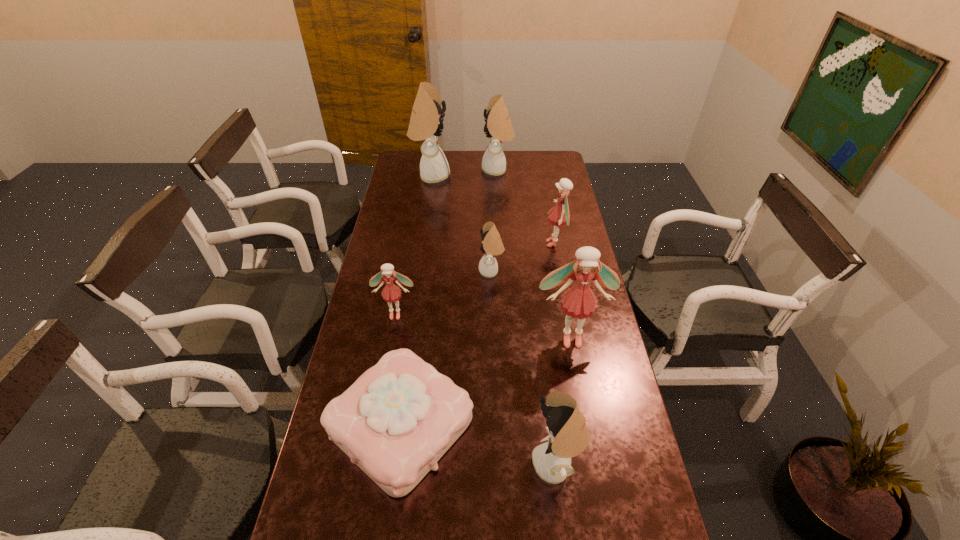
The image size is (960, 540). What are the coordinates of `the leftmost black doll` in the screenshot? It's located at (426, 123).

In order to click on the biggest black doll in this screenshot , I will do `click(426, 123)`.

Locate an element on the screen. the third smallest black doll is located at coordinates (498, 127).

Identify the location of the third nearest object. (579, 301).

Locate an element on the screen. The image size is (960, 540). the nearest pink doll is located at coordinates (579, 301).

Locate an element on the screen. Image resolution: width=960 pixels, height=540 pixels. the second biggest pink doll is located at coordinates (559, 216).

Where is `the third biggest black doll`? This screenshot has width=960, height=540. the third biggest black doll is located at coordinates (569, 437).

Find the location of `the nearest black doll`. the nearest black doll is located at coordinates (569, 437).

Where is `the second nearest black doll`? The image size is (960, 540). the second nearest black doll is located at coordinates (492, 245).

This screenshot has height=540, width=960. In order to click on the fifth farthest doll in this screenshot , I will do `click(391, 293)`.